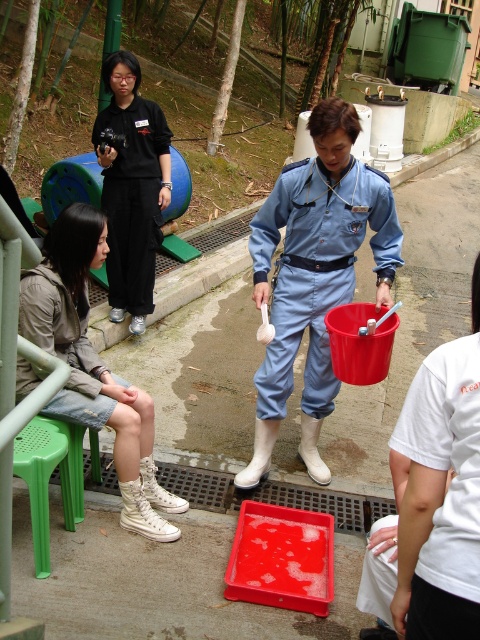
Question: Does denim jacket at lower left appear under green plastic stool at lower left?

Choices:
 (A) yes
 (B) no

Answer: (B)

Question: Which point is closer to the camera taking this photo?

Choices:
 (A) (35, 465)
 (B) (140, 140)
 (C) (103, 419)

Answer: (A)

Question: Does matte blue jumpsuit at center appear on the left side of green plastic stool at lower left?

Choices:
 (A) yes
 (B) no

Answer: (B)

Question: Which of the following is the closest to the observer?

Choices:
 (A) black matte uniform at upper left
 (B) green plastic stool at lower left
 (C) white matte uniform at center
 (D) denim jacket at lower left

Answer: (C)

Question: Is black matte uniform at upper left positioned in front of denim jacket at lower left?

Choices:
 (A) yes
 (B) no

Answer: (B)

Question: Which object is positioned farthest from the green plastic stool at lower left?

Choices:
 (A) denim jacket at lower left
 (B) matte blue jumpsuit at center

Answer: (B)